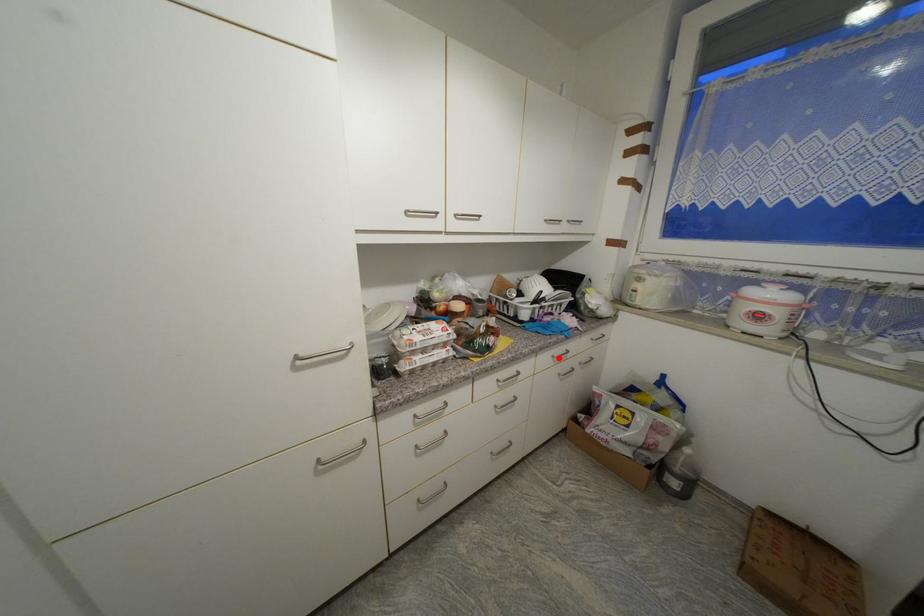
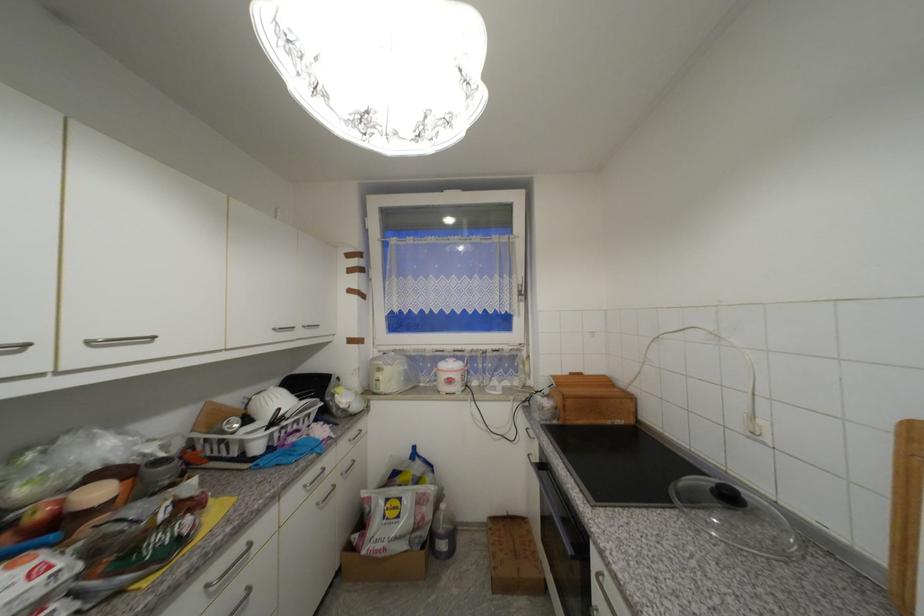
Question: I am providing you with two images of the same scene from different viewpoints. Image1 has a red point marked. In image2, the corresponding 3D location appears at what relative position? Reply with the corresponding letter.

Choices:
 (A) Closer
 (B) Farther

Answer: (A)